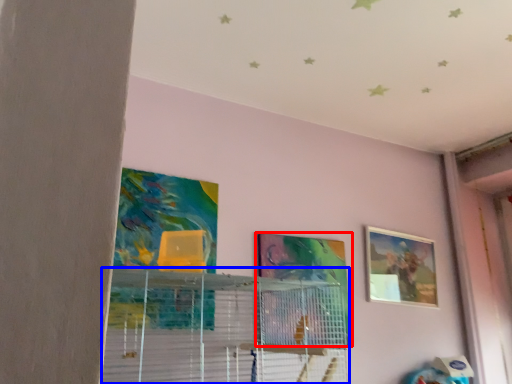
Question: Which object appears farthest to the camera in this image, picture frame (highlighted by a red box) or shelf (highlighted by a blue box)?

Choices:
 (A) picture frame
 (B) shelf

Answer: (A)